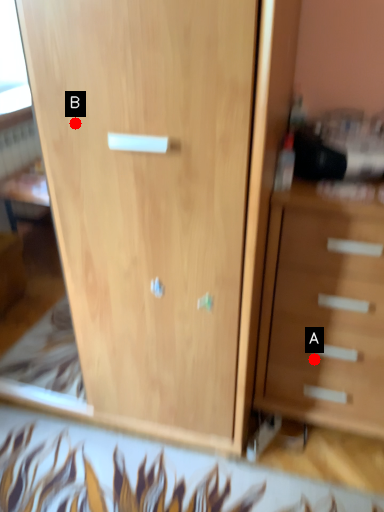
Question: Two points are circled on the image, labeled by A and B beside each circle. Which point appears farthest from the camera in this image?

Choices:
 (A) A is further
 (B) B is further

Answer: (A)